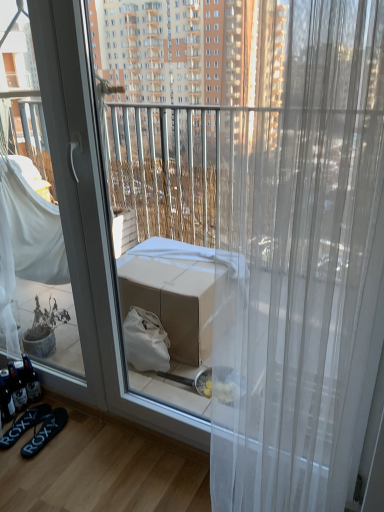
Question: From a real-world perspective, is black fabric flip-flops at lower left, placed as the first footwear when sorted from left to right, positioned over transparent sheer curtain at center based on gravity?

Choices:
 (A) no
 (B) yes

Answer: (A)

Question: Is transparent sheer curtain at center at the back of black fabric flip-flops at lower left, the 2th footwear in the right-to-left sequence?

Choices:
 (A) no
 (B) yes

Answer: (A)

Question: Would you say black fabric flip-flops at lower left, placed as the first footwear when sorted from left to right, is outside transparent sheer curtain at center?

Choices:
 (A) yes
 (B) no

Answer: (A)

Question: Is black fabric flip-flops at lower left, placed as the first footwear when sorted from left to right, shorter than transparent sheer curtain at center?

Choices:
 (A) no
 (B) yes

Answer: (B)

Question: Can you confirm if black fabric flip-flops at lower left, placed as the first footwear when sorted from left to right, is wider than transparent sheer curtain at center?

Choices:
 (A) no
 (B) yes

Answer: (B)

Question: Is the position of black fabric flip-flops at lower left, the 2th footwear in the right-to-left sequence, less distant than that of transparent sheer curtain at center?

Choices:
 (A) yes
 (B) no

Answer: (B)

Question: From a real-world perspective, is black fabric flip-flops at lower left, the 2th footwear in the right-to-left sequence, located higher than black rubber flip-flops at lower left, which appears as the 2th footwear when viewed from the left?

Choices:
 (A) yes
 (B) no

Answer: (A)

Question: Is black fabric flip-flops at lower left, placed as the first footwear when sorted from left to right, not close to black rubber flip-flops at lower left, which appears as the 2th footwear when viewed from the left?

Choices:
 (A) no
 (B) yes

Answer: (A)

Question: Could you tell me if black fabric flip-flops at lower left, placed as the first footwear when sorted from left to right, is facing black rubber flip-flops at lower left, which appears as the 2th footwear when viewed from the left?

Choices:
 (A) yes
 (B) no

Answer: (B)

Question: Is black fabric flip-flops at lower left, placed as the first footwear when sorted from left to right, looking in the opposite direction of black rubber flip-flops at lower left, the first footwear when ordered from right to left?

Choices:
 (A) no
 (B) yes

Answer: (A)

Question: Is black fabric flip-flops at lower left, placed as the first footwear when sorted from left to right, in contact with black rubber flip-flops at lower left, which appears as the 2th footwear when viewed from the left?

Choices:
 (A) no
 (B) yes

Answer: (B)

Question: Is black fabric flip-flops at lower left, placed as the first footwear when sorted from left to right, outside of black rubber flip-flops at lower left, which appears as the 2th footwear when viewed from the left?

Choices:
 (A) no
 (B) yes

Answer: (B)

Question: Does black rubber flip-flops at lower left, the first footwear when ordered from right to left, appear on the right side of transparent sheer curtain at center?

Choices:
 (A) no
 (B) yes

Answer: (A)